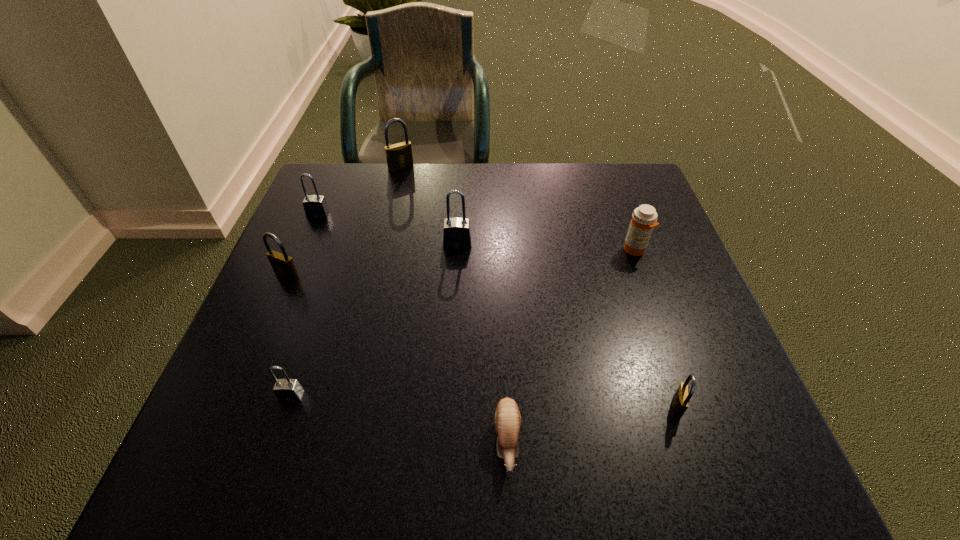
At what (x,y) coordinates should I click in order to perform the action: click on vacant space situated on the shackle of the smallest gray padlock. Please return your answer as a coordinate pair (x, y). This screenshot has height=540, width=960. Looking at the image, I should click on (263, 481).

Where is `vacant space situated 0.200m on the back of the rightmost padlock`? Image resolution: width=960 pixels, height=540 pixels. vacant space situated 0.200m on the back of the rightmost padlock is located at coordinates (643, 307).

The width and height of the screenshot is (960, 540). I want to click on object situated at the near edge, so (507, 417).

Find the location of a particular element. The width and height of the screenshot is (960, 540). medicine that is positioned at the right edge is located at coordinates (644, 218).

Locate an element on the screen. This screenshot has height=540, width=960. padlock at the right edge is located at coordinates (680, 402).

I want to click on object situated at the far left corner, so click(315, 206).

This screenshot has width=960, height=540. In the image, there is a desktop. Find the location of `free space at the far edge`. free space at the far edge is located at coordinates (513, 162).

The width and height of the screenshot is (960, 540). In the image, there is a desktop. Identify the location of vacant space at the near edge. (635, 476).

Locate an element on the screen. vacant space at the left edge of the desktop is located at coordinates (344, 237).

Locate an element on the screen. free space at the right edge of the desktop is located at coordinates (684, 268).